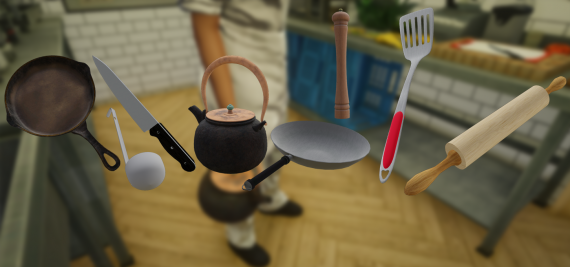
At what (x,y) coordinates should I click in order to perform the action: click on wood floor. Please return your answer as a coordinate pair (x, y). The height and width of the screenshot is (267, 570). Looking at the image, I should click on (335, 243).